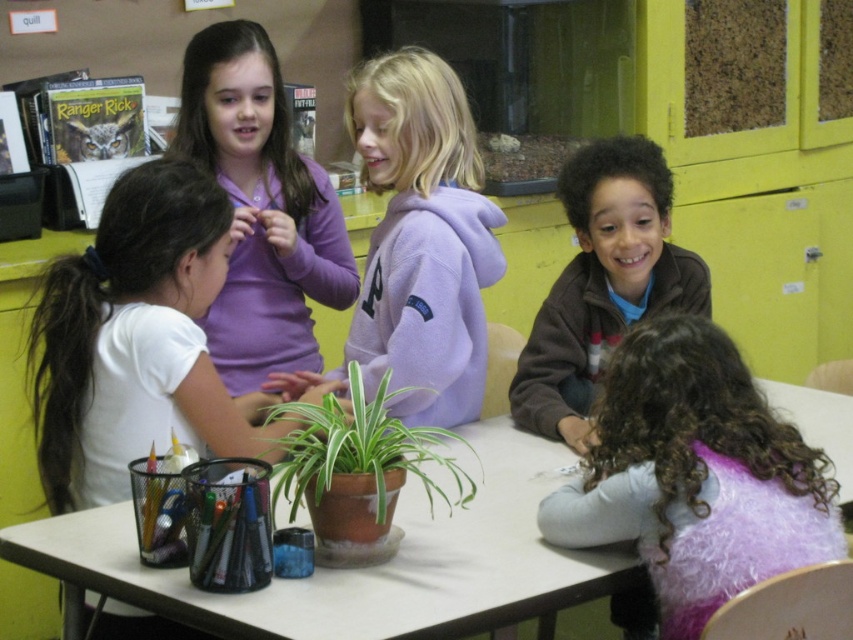
Question: Which point is closer to the camera?

Choices:
 (A) green matte plant at center
 (B) white matte shirt at left

Answer: (A)

Question: Which point is closer to the camera?

Choices:
 (A) green matte plant at center
 (B) white plastic table at center

Answer: (B)

Question: Can you confirm if white plastic table at center is positioned to the left of curly hair at lower right?

Choices:
 (A) no
 (B) yes

Answer: (B)

Question: Which of the following is the closest to the observer?

Choices:
 (A) (141, 211)
 (B) (453, 365)

Answer: (A)

Question: Is curly hair at lower right bigger than purple fleece hoodie at upper center?

Choices:
 (A) yes
 (B) no

Answer: (B)

Question: Can you confirm if curly hair at lower right is positioned below purple fleece hoodie at upper left?

Choices:
 (A) no
 (B) yes

Answer: (B)